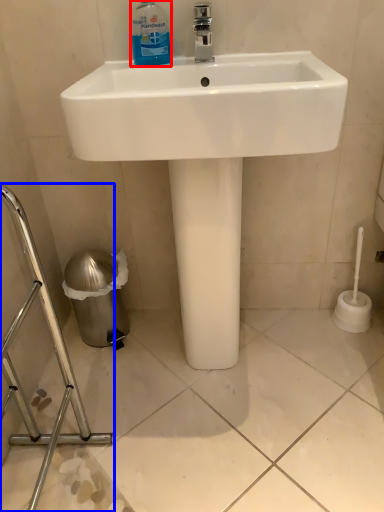
Question: Which of the following is the farthest to the observer, cleaning product (highlighted by a red box) or porcelain (highlighted by a blue box)?

Choices:
 (A) cleaning product
 (B) porcelain

Answer: (A)